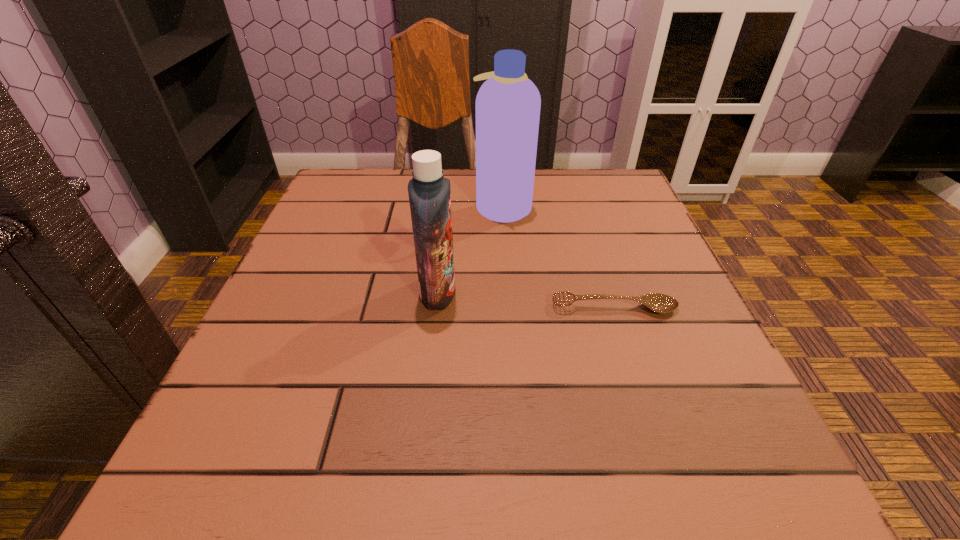
Where is `the farthest object`? The image size is (960, 540). the farthest object is located at coordinates (508, 104).

The width and height of the screenshot is (960, 540). What are the coordinates of `the farther shampoo` in the screenshot? It's located at (508, 104).

The image size is (960, 540). In order to click on the shorter shampoo in this screenshot , I will do pos(429,192).

Identify the location of the left shampoo. (429, 192).

What are the coordinates of `the rightmost object` in the screenshot? It's located at (660, 303).

Locate an element on the screen. The width and height of the screenshot is (960, 540). ladle is located at coordinates (660, 303).

I want to click on vacant space located on the front of the farther shampoo, so click(509, 295).

I want to click on vacant region located on the front label of the leftmost object, so click(x=634, y=292).

Where is `free space located on the left of the ladle`? This screenshot has width=960, height=540. free space located on the left of the ladle is located at coordinates (344, 308).

The image size is (960, 540). I want to click on object that is at the far edge, so click(508, 104).